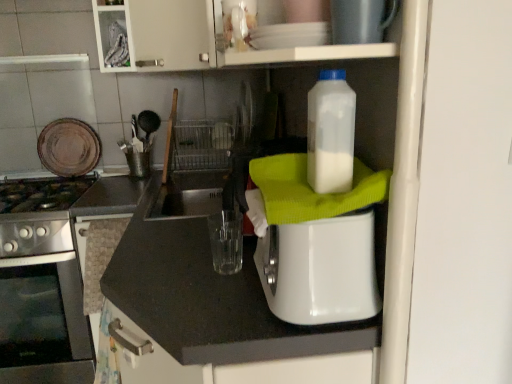
Question: Considering the positions of white plastic toaster at center, the second appliance from the left, and translucent plastic bottle at upper right in the image, is white plastic toaster at center, the second appliance from the left, taller or shorter than translucent plastic bottle at upper right?

Choices:
 (A) tall
 (B) short

Answer: (A)

Question: From the image's perspective, is white plastic toaster at center, which ranks as the second appliance in right-to-left order, above or below translucent plastic bottle at upper right?

Choices:
 (A) above
 (B) below

Answer: (B)

Question: Estimate the real-world distances between objects in this image. Which object is farther from the white plastic toaster at center, marked as the 2th appliance in a front-to-back arrangement?

Choices:
 (A) stainless steel oven at left
 (B) stainless steel gas stove at lower left
 (C) white matte cabinet at upper center
 (D) brown matte plate at upper left, arranged as the first appliance when viewed from the left
 (E) metallic silver toaster at upper center, marked as the first appliance in a right-to-left arrangement

Answer: (D)

Question: Considering the real-world distances, which object is farthest from the white matte cabinet at upper center?

Choices:
 (A) brown matte plate at upper left, which is the third appliance in front-to-back order
 (B) stainless steel gas stove at lower left
 (C) white plastic toaster at center, which ranks as the 2th appliance in back-to-front order
 (D) metallic silver toaster at upper center, marked as the first appliance in a right-to-left arrangement
 (E) translucent plastic bottle at upper right

Answer: (B)